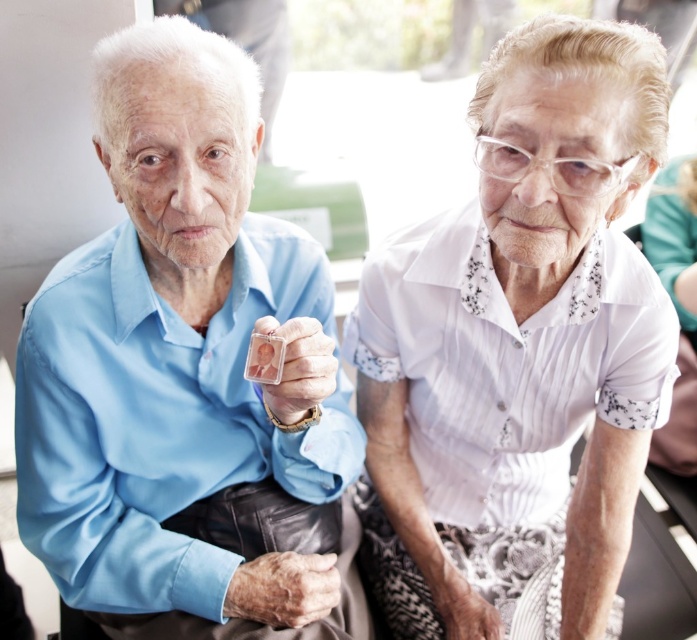
Can you confirm if matte blue shirt at center is wider than white textured blouse at upper right?

Yes.

Is matte blue shirt at center taller than white textured blouse at upper right?

No.

This screenshot has height=640, width=697. Identify the location of matte blue shirt at center. (187, 376).

The width and height of the screenshot is (697, 640). I want to click on matte blue shirt at center, so click(x=187, y=376).